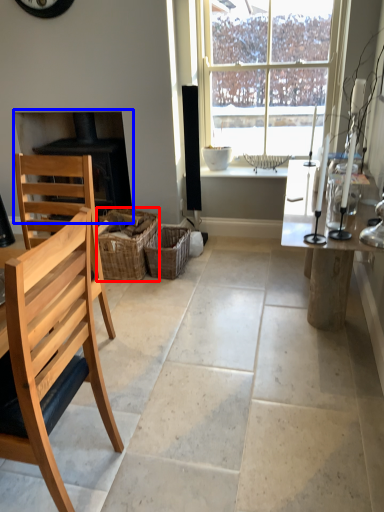
Question: Which object is closer to the camera taking this photo, crate (highlighted by a red box) or fireplace (highlighted by a blue box)?

Choices:
 (A) crate
 (B) fireplace

Answer: (A)